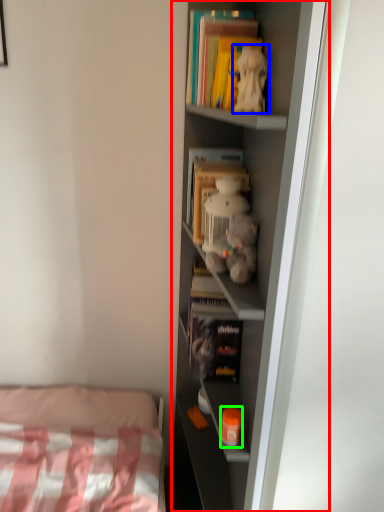
Question: Considering the real-world distances, which object is closest to shelf (highlighted by a red box)? toy (highlighted by a blue box) or toy (highlighted by a green box).

Choices:
 (A) toy
 (B) toy

Answer: (A)